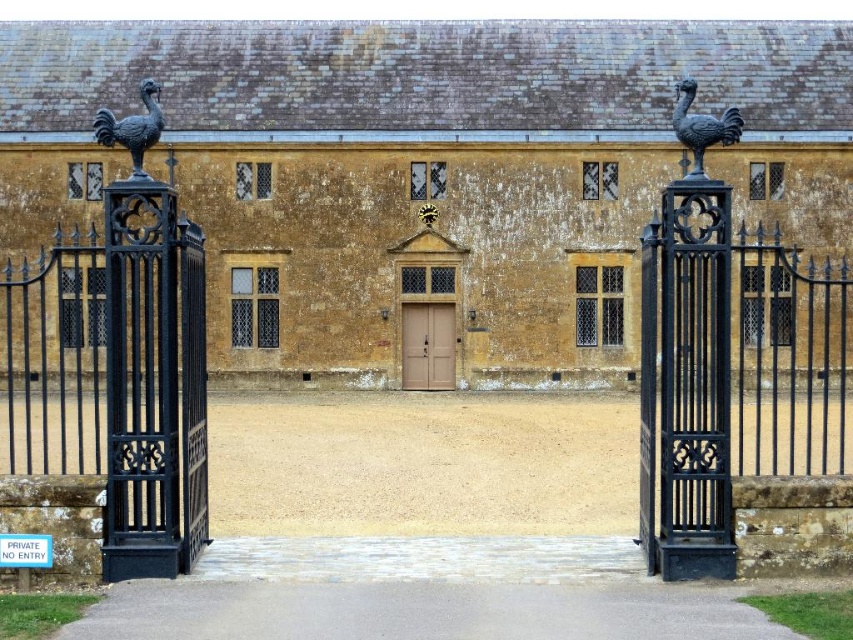
Question: Is matte gold stone building at center further to camera compared to black wrought iron gate at right?

Choices:
 (A) yes
 (B) no

Answer: (A)

Question: Does matte gold stone building at center have a smaller size compared to black wrought iron gate at right?

Choices:
 (A) yes
 (B) no

Answer: (B)

Question: Which point is farther to the camera?

Choices:
 (A) matte gold stone building at center
 (B) black wrought iron gate at center
 (C) brown wooden door at center
 (D) black wrought iron gate at right

Answer: (C)

Question: Among these points, which one is nearest to the camera?

Choices:
 (A) [415, 385]
 (B) [682, 200]
 (C) [12, 332]

Answer: (B)

Question: Is black wrought iron gate at center further to camera compared to brown wooden door at center?

Choices:
 (A) yes
 (B) no

Answer: (B)

Question: Which point is farther from the camera taking this photo?

Choices:
 (A) (402, 385)
 (B) (51, 148)
 (C) (669, 528)

Answer: (B)